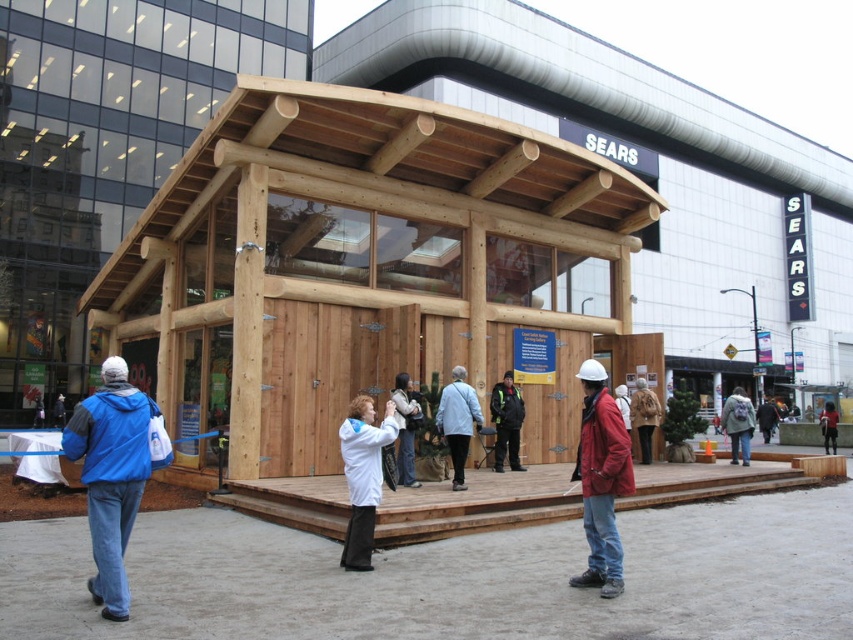
Based on the photo, you are a photographer standing in front of the wooden structure. You notice two jackets at the center of the scene. Which jacket is taller between the matte red jacket at center and the light brown leather jacket at center?

The matte red jacket at center is taller than the light brown leather jacket at center according to the description.

You are planning to hang a banner between the light blue fabric coat at center and the black leather jacket at center. Since both are at the same position, how can you decide where to hang the banner?

The light blue fabric coat at center is not as tall as the black leather jacket at center, so you should hang the banner at the height of the taller black leather jacket at center to ensure visibility over both.

You are planning to install a safety barrier between the matte red jacket at center and the light brown leather jacket at center. The barrier requires a minimum of 9 meters of material. Do you have enough space to install it?

The distance between the matte red jacket at center and the light brown leather jacket at center is 8.86 meters, which is less than the required 9 meters. Therefore, the barrier cannot be installed with the available space.